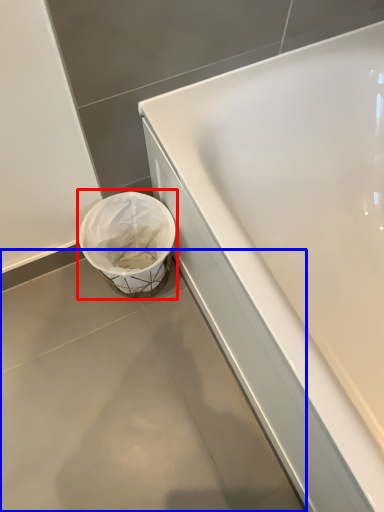
Question: Which point is closer to the camera, waste container (highlighted by a red box) or concrete (highlighted by a blue box)?

Choices:
 (A) waste container
 (B) concrete

Answer: (B)